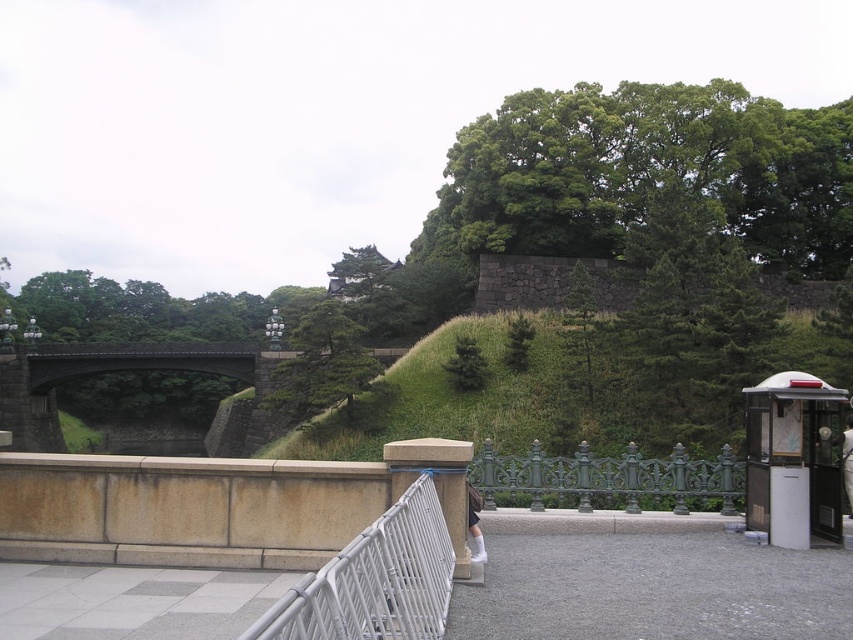
You are a pedestrian standing on the dark gray stone bridge at center and want to walk to the green cast iron fence at center. Is the fence above or below your current position?

The dark gray stone bridge at center is positioned under the green cast iron fence at center, so the fence is above your current position.

You are standing at the point labeled as point (375, 580) in the image. What object is located exactly at this point?

The point (375, 580) indicates a white metal fence at center.